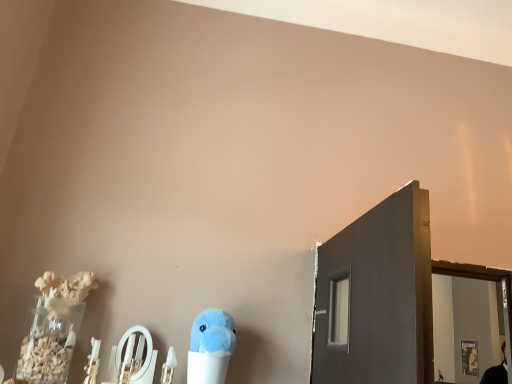
The image size is (512, 384). What are the coordinates of `metallic silver mirror at lower center` in the screenshot? It's located at (146, 354).

The image size is (512, 384). What do you see at coordinates (146, 354) in the screenshot? I see `metallic silver mirror at lower center` at bounding box center [146, 354].

What do you see at coordinates (211, 347) in the screenshot? This screenshot has height=384, width=512. I see `fluffy blue plush at center` at bounding box center [211, 347].

The height and width of the screenshot is (384, 512). Identify the location of fluffy blue plush at center. (211, 347).

Locate an element on the screen. metallic silver mirror at lower center is located at coordinates (146, 354).

Between fluffy blue plush at center and metallic silver mirror at lower center, which one appears on the right side from the viewer's perspective?

fluffy blue plush at center.

Is fluffy blue plush at center further to camera compared to metallic silver mirror at lower center?

No, the depth of fluffy blue plush at center is less than that of metallic silver mirror at lower center.

Is point (197, 342) closer to viewer compared to point (143, 329)?

Yes, it is in front of point (143, 329).

From the image's perspective, does fluffy blue plush at center appear lower than metallic silver mirror at lower center?

Yes.

From a real-world perspective, between fluffy blue plush at center and metallic silver mirror at lower center, who is vertically higher?

From a 3D spatial view, fluffy blue plush at center is above.

Considering the sizes of objects fluffy blue plush at center and metallic silver mirror at lower center in the image provided, who is thinner, fluffy blue plush at center or metallic silver mirror at lower center?

metallic silver mirror at lower center is thinner.

Between fluffy blue plush at center and metallic silver mirror at lower center, which one has less height?

metallic silver mirror at lower center is shorter.

Looking at the image, does fluffy blue plush at center seem bigger or smaller compared to metallic silver mirror at lower center?

Considering their sizes, fluffy blue plush at center takes up more space than metallic silver mirror at lower center.

Would you say fluffy blue plush at center is inside or outside metallic silver mirror at lower center?

fluffy blue plush at center is not inside metallic silver mirror at lower center, it's outside.

Is fluffy blue plush at center positioned far away from metallic silver mirror at lower center?

No.

Could you tell me if fluffy blue plush at center is turned towards metallic silver mirror at lower center?

No, fluffy blue plush at center is not facing towards metallic silver mirror at lower center.

How many degrees apart are the facing directions of fluffy blue plush at center and metallic silver mirror at lower center?

There is a 6.85-degree angle between the facing directions of fluffy blue plush at center and metallic silver mirror at lower center.

Where is `mirror behind the fluffy blue plush at center`? Image resolution: width=512 pixels, height=384 pixels. mirror behind the fluffy blue plush at center is located at coordinates pos(146,354).

Is metallic silver mirror at lower center to the left or to the right of fluffy blue plush at center in the image?

From the image, it's evident that metallic silver mirror at lower center is to the left of fluffy blue plush at center.

Considering the positions of objects metallic silver mirror at lower center and fluffy blue plush at center in the image provided, who is behind, metallic silver mirror at lower center or fluffy blue plush at center?

Positioned behind is metallic silver mirror at lower center.

Considering the points (147, 367) and (193, 353), which point is in front, point (147, 367) or point (193, 353)?

The point (193, 353) is in front.

From the image's perspective, between metallic silver mirror at lower center and fluffy blue plush at center, who is located below?

fluffy blue plush at center.

From a real-world perspective, is metallic silver mirror at lower center physically located above or below fluffy blue plush at center?

metallic silver mirror at lower center is situated lower than fluffy blue plush at center in the real world.

Looking at their sizes, would you say metallic silver mirror at lower center is wider or thinner than fluffy blue plush at center?

In the image, metallic silver mirror at lower center appears to be more narrow than fluffy blue plush at center.

Considering the relative sizes of metallic silver mirror at lower center and fluffy blue plush at center in the image provided, is metallic silver mirror at lower center shorter than fluffy blue plush at center?

Yes, metallic silver mirror at lower center is shorter than fluffy blue plush at center.

Can you confirm if metallic silver mirror at lower center is smaller than fluffy blue plush at center?

Indeed, metallic silver mirror at lower center has a smaller size compared to fluffy blue plush at center.

Is metallic silver mirror at lower center outside of fluffy blue plush at center?

metallic silver mirror at lower center lies outside fluffy blue plush at center's area.

Looking at this image, can you see metallic silver mirror at lower center touching fluffy blue plush at center?

No.

Is metallic silver mirror at lower center aimed at fluffy blue plush at center?

No.

You are a GUI agent. You are given a task and a screenshot of the screen. Output one action in this format:
    pyautogui.click(x=<x>, y=<y>)
    Task: Click on the mirror located behind the fluffy blue plush at center
    
    Given the screenshot: What is the action you would take?
    pyautogui.click(x=146, y=354)

This screenshot has width=512, height=384. What are the coordinates of `toy below the metallic silver mirror at lower center (from the image's perspective)` in the screenshot? It's located at (211, 347).

The image size is (512, 384). Identify the location of mirror above the fluffy blue plush at center (from the image's perspective). (146, 354).